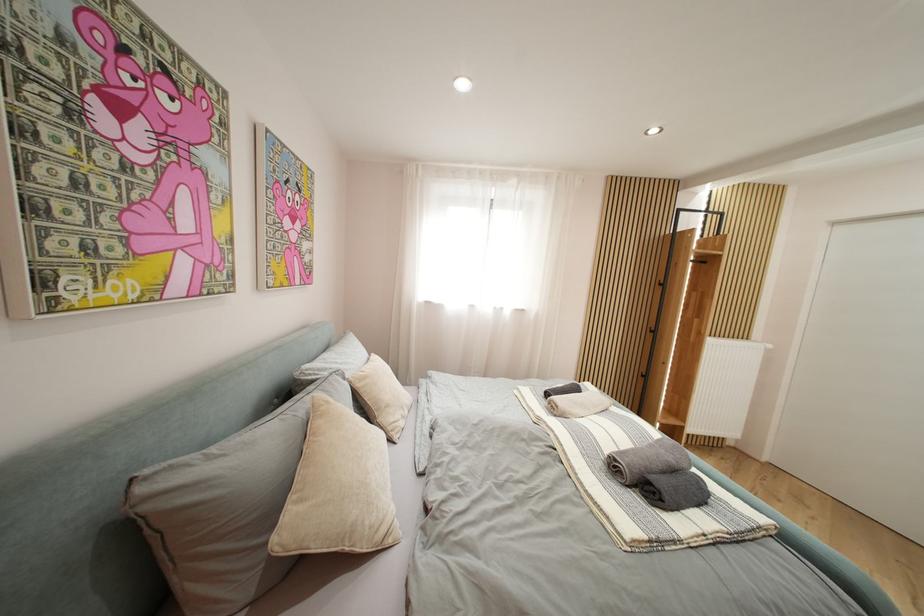
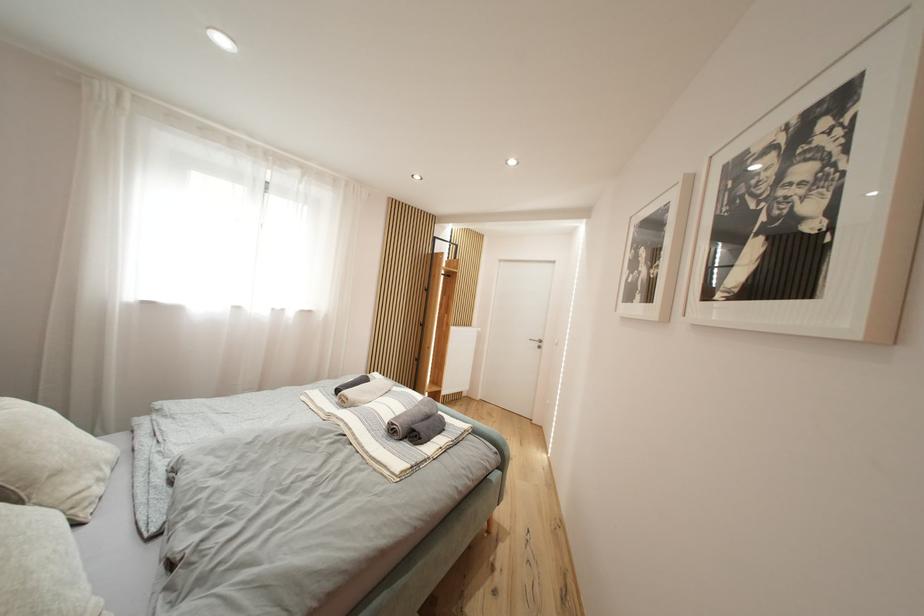
Question: The camera is either moving clockwise (left) or counter-clockwise (right) around the object. The first image is from the beginning of the video and the second image is from the end. Is the camera moving left or right when shooting the video?

Choices:
 (A) Left
 (B) Right

Answer: (A)